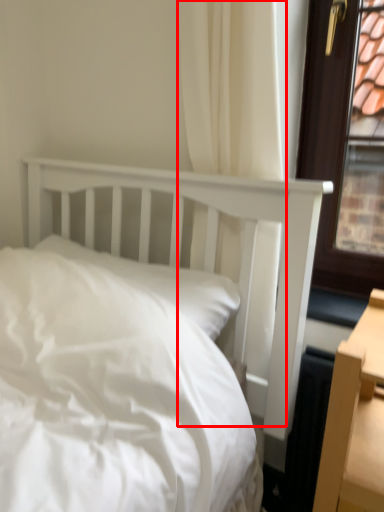
Question: Where is curtain (annotated by the red box) located in relation to pillow in the image?

Choices:
 (A) left
 (B) right

Answer: (B)